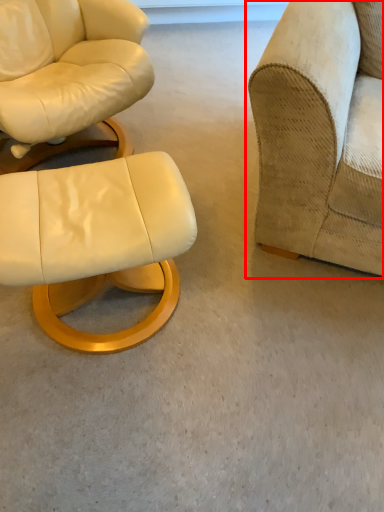
Question: From the image's perspective, considering the relative positions of studio couch (annotated by the red box) and chair in the image provided, where is studio couch (annotated by the red box) located with respect to the staircase?

Choices:
 (A) above
 (B) below

Answer: (A)